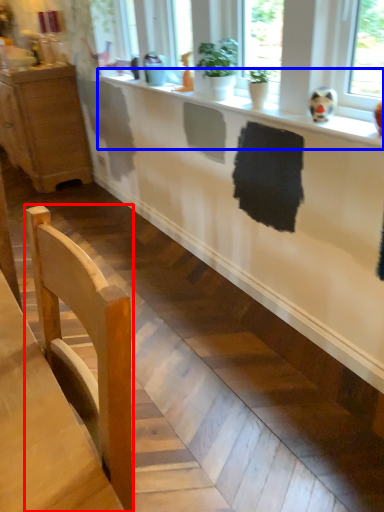
Question: Which of the following is the farthest to the observer, chair (highlighted by a red box) or counter top (highlighted by a blue box)?

Choices:
 (A) chair
 (B) counter top

Answer: (B)